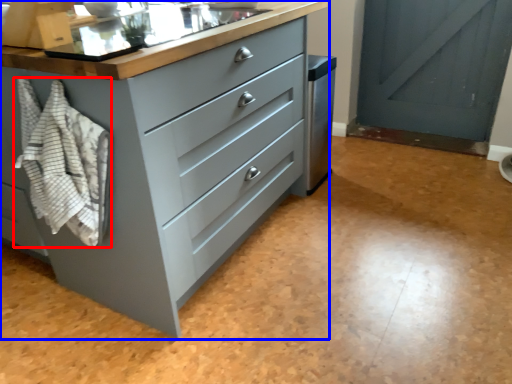
Question: Which object is closer to the camera taking this photo, blanket (highlighted by a red box) or chest of drawers (highlighted by a blue box)?

Choices:
 (A) blanket
 (B) chest of drawers

Answer: (B)